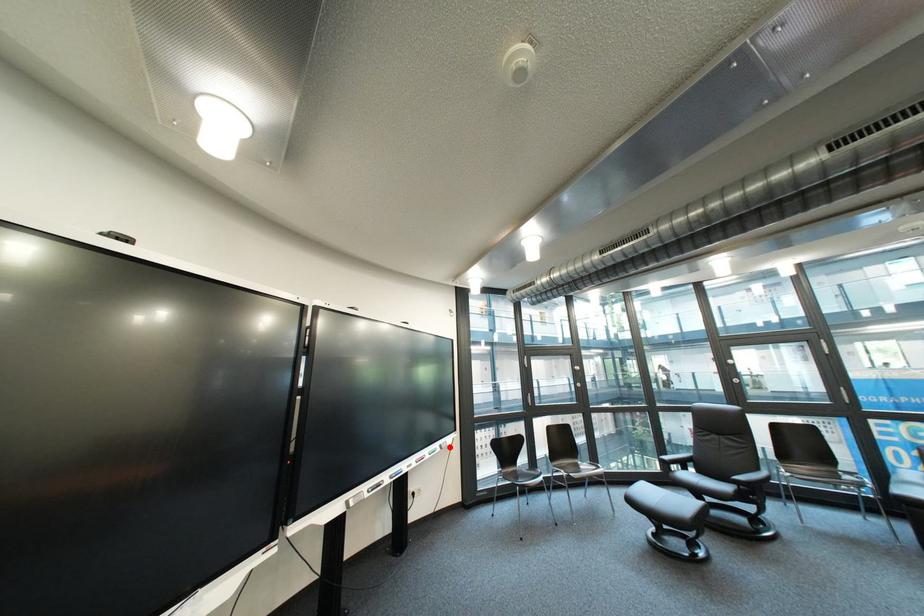
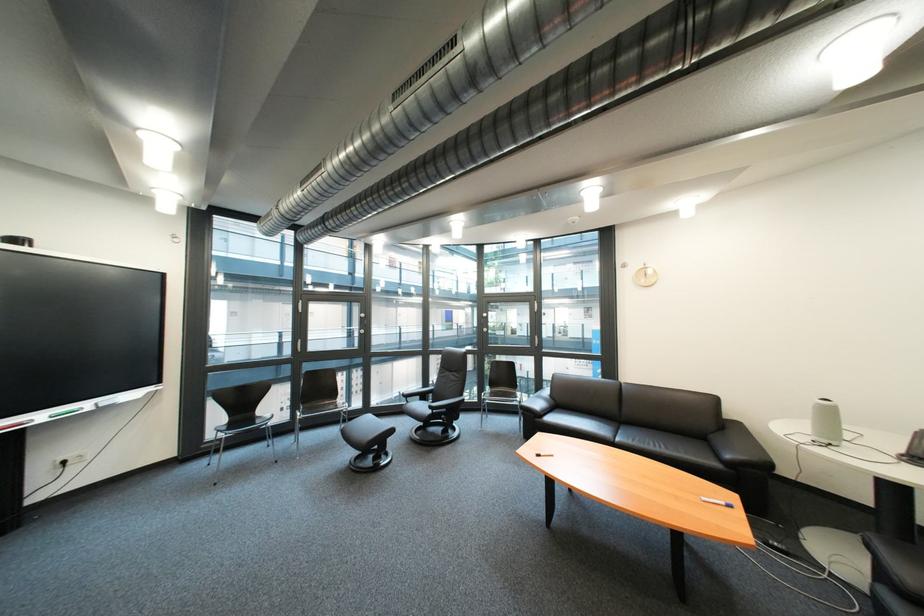
Question: I am providing you with two images of the same scene from different viewpoints. A red point is shown in image1. For the corresponding object point in image2, is it positioned nearer or farther from the camera?

Choices:
 (A) Nearer
 (B) Farther

Answer: (A)